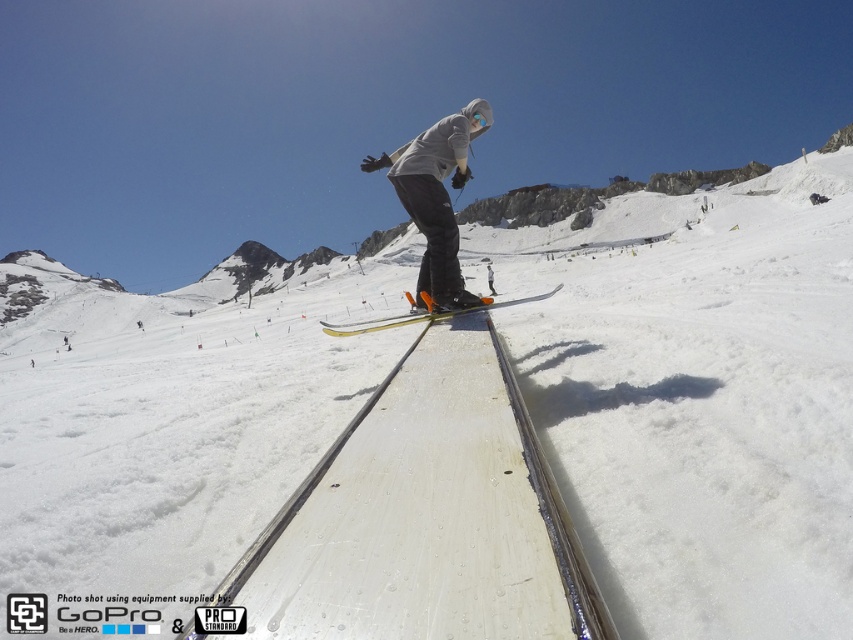
Question: Can you confirm if gray fleece jacket at center is smaller than yellow metallic skis at center?

Choices:
 (A) no
 (B) yes

Answer: (B)

Question: Based on their relative distances, which object is farther from the yellow metallic skis at center?

Choices:
 (A) gray fleece jacket at center
 (B) white matte snowboarder at center

Answer: (B)

Question: Is white matte snowboarder at center in front of yellow metallic skis at center?

Choices:
 (A) yes
 (B) no

Answer: (B)

Question: Which object is farther from the camera taking this photo?

Choices:
 (A) yellow metallic skis at center
 (B) white matte snowboarder at center

Answer: (B)

Question: Can you confirm if gray fleece jacket at center is smaller than yellow metallic skis at center?

Choices:
 (A) no
 (B) yes

Answer: (B)

Question: Which of these objects is positioned closest to the white matte snowboarder at center?

Choices:
 (A) gray fleece jacket at center
 (B) yellow metallic skis at center

Answer: (A)